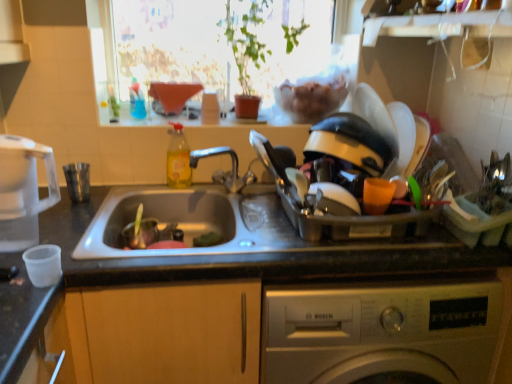
Question: From a real-world perspective, is translucent yellow liquid at sink left under silver metallic washing machine at lower center?

Choices:
 (A) yes
 (B) no

Answer: (B)

Question: Would you consider translucent yellow liquid at sink left to be distant from silver metallic washing machine at lower center?

Choices:
 (A) no
 (B) yes

Answer: (A)

Question: From the image's perspective, is translucent yellow liquid at sink left on top of silver metallic washing machine at lower center?

Choices:
 (A) no
 (B) yes

Answer: (B)

Question: From the image's perspective, is translucent yellow liquid at sink left below silver metallic washing machine at lower center?

Choices:
 (A) no
 (B) yes

Answer: (A)

Question: Is translucent yellow liquid at sink left positioned in front of silver metallic washing machine at lower center?

Choices:
 (A) no
 (B) yes

Answer: (A)

Question: Is transparent glass window at upper center wider or thinner than shiny plastic dish rack at right, marked as the 2th appliance in a left-to-right arrangement?

Choices:
 (A) wide
 (B) thin

Answer: (B)

Question: Based on their positions, is transparent glass window at upper center located to the left or right of shiny plastic dish rack at right, marked as the 2th appliance in a left-to-right arrangement?

Choices:
 (A) left
 (B) right

Answer: (A)

Question: Is transparent glass window at upper center situated inside shiny plastic dish rack at right, marked as the 2th appliance in a left-to-right arrangement, or outside?

Choices:
 (A) outside
 (B) inside

Answer: (A)

Question: Considering the positions of point (184, 69) and point (395, 220), is point (184, 69) closer or farther from the camera than point (395, 220)?

Choices:
 (A) farther
 (B) closer

Answer: (A)

Question: In terms of height, does transparent plastic kettle at left, the second appliance when ordered from right to left, look taller or shorter compared to silver metallic washing machine at lower center?

Choices:
 (A) short
 (B) tall

Answer: (A)

Question: Looking at their shapes, would you say transparent plastic kettle at left, which ranks as the first appliance in left-to-right order, is wider or thinner than silver metallic washing machine at lower center?

Choices:
 (A) wide
 (B) thin

Answer: (B)

Question: Is point (29, 233) closer or farther from the camera than point (393, 317)?

Choices:
 (A) farther
 (B) closer

Answer: (B)

Question: Looking at the image, does transparent plastic kettle at left, the second appliance when ordered from right to left, seem bigger or smaller compared to silver metallic washing machine at lower center?

Choices:
 (A) big
 (B) small

Answer: (B)

Question: In terms of size, does silver metallic washing machine at lower center appear bigger or smaller than translucent yellow liquid at sink left?

Choices:
 (A) small
 (B) big

Answer: (B)

Question: Based on their positions, is silver metallic washing machine at lower center located to the left or right of translucent yellow liquid at sink left?

Choices:
 (A) left
 (B) right

Answer: (B)